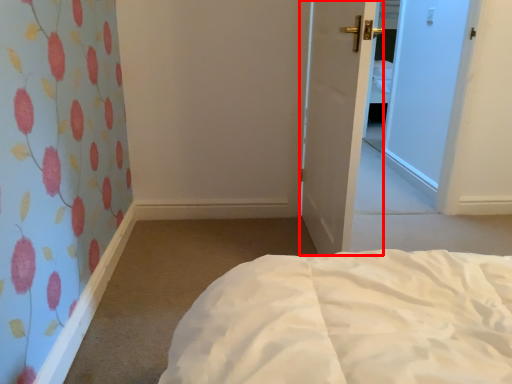
Question: From the image's perspective, what is the correct spatial positioning of door (annotated by the red box) in reference to bed?

Choices:
 (A) below
 (B) above

Answer: (B)